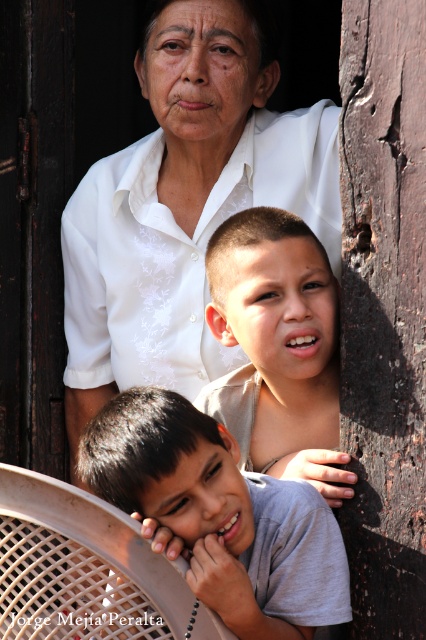
Looking at the two shirts in the image, the white textured shirt at upper center and the smooth beige shirt at center, which one is bigger in size?

The white textured shirt at upper center is larger in size compared to the smooth beige shirt at center according to the description.

You are a photographer standing 3 meters away from the gray cotton shirt at lower left. You want to take a photo of the white textured shirt at upper center without moving the subjects. Can you capture both shirts in the same frame?

The distance between the white textured shirt at upper center and gray cotton shirt at lower left is 2.53 meters. Since you are 3 meters away from the gray cotton shirt at lower left, the white textured shirt at upper center would be within your camera frame as the total distance from you to the white textured shirt at upper center is 3 meters plus 2.53 meters, totaling 5.53 meters. However, camera lenses typically have a field of view that can encompass objects at varying distances as long as they are in a